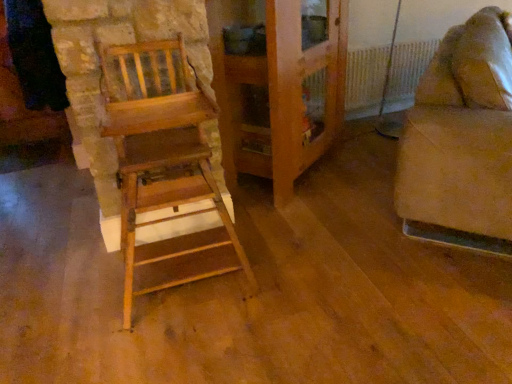
Locate an element on the screen. This screenshot has width=512, height=384. free space on the front side of wooden chair at left, placed as the 1th furniture when sorted from left to right is located at coordinates (184, 347).